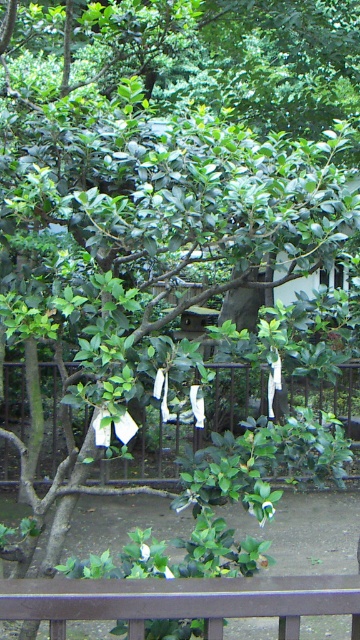
In the scene shown: Does black metal fence at center come in front of metallic gray fence at bottom?

No, black metal fence at center is behind metallic gray fence at bottom.

Is black metal fence at center below metallic gray fence at bottom?

Indeed, black metal fence at center is positioned under metallic gray fence at bottom.

At what (x,y) coordinates should I click in order to perform the action: click on black metal fence at center. Please return your answer as a coordinate pair (x, y). The image size is (360, 640). Looking at the image, I should click on (187, 426).